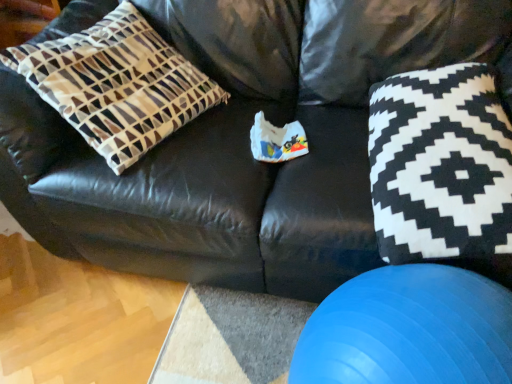
Describe the element at coordinates (409, 330) in the screenshot. I see `blue rubber ball at lower right` at that location.

Identify the location of black and white fabric pillow at right. This screenshot has width=512, height=384. (440, 165).

Is the position of blue rubber ball at lower right more distant than that of black and white fabric pillow at right?

No, blue rubber ball at lower right is closer to the camera.

From the image's perspective, is blue rubber ball at lower right over black and white fabric pillow at right?

Incorrect, from the image's perspective, blue rubber ball at lower right is lower than black and white fabric pillow at right.

Would you say blue rubber ball at lower right is inside or outside black and white fabric pillow at right?

blue rubber ball at lower right is not inside black and white fabric pillow at right, it's outside.

From a real-world perspective, which object rests below the other?

blue rubber ball at lower right is physically lower.

From a real-world perspective, between black and white fabric pillow at right and brown and white geometric pillow at left, who is vertically lower?

black and white fabric pillow at right, from a real-world perspective.

Between black and white fabric pillow at right and brown and white geometric pillow at left, which one has larger width?

black and white fabric pillow at right is wider.

Is black and white fabric pillow at right behind brown and white geometric pillow at left?

No, black and white fabric pillow at right is closer to the viewer.

Is black and white fabric pillow at right not near brown and white geometric pillow at left?

No.

Looking at the image, does black and white fabric pillow at right seem bigger or smaller compared to blue rubber ball at lower right?

black and white fabric pillow at right is smaller than blue rubber ball at lower right.

Who is taller, black and white fabric pillow at right or blue rubber ball at lower right?

Standing taller between the two is blue rubber ball at lower right.

Which is in front, point (387, 80) or point (410, 288)?

Positioned in front is point (410, 288).

Which object is positioned more to the right, black and white fabric pillow at right or blue rubber ball at lower right?

black and white fabric pillow at right.

At what (x,y) coordinates should I click in order to perform the action: click on throw pillow below the brown and white geometric pillow at left (from the image's perspective). Please return your answer as a coordinate pair (x, y). The height and width of the screenshot is (384, 512). Looking at the image, I should click on (440, 165).

Is brown and white geometric pillow at left aimed at black and white fabric pillow at right?

No, brown and white geometric pillow at left is not oriented towards black and white fabric pillow at right.

From the image's perspective, is brown and white geometric pillow at left above or below black and white fabric pillow at right?

Clearly, from the image's perspective, brown and white geometric pillow at left is above black and white fabric pillow at right.

From the image's perspective, relative to brown and white geometric pillow at left, is blue rubber ball at lower right above or below?

Based on their image positions, blue rubber ball at lower right is located beneath brown and white geometric pillow at left.

From a real-world perspective, is blue rubber ball at lower right above or below brown and white geometric pillow at left?

From a real-world perspective, blue rubber ball at lower right is physically below brown and white geometric pillow at left.

Is brown and white geometric pillow at left surrounded by blue rubber ball at lower right?

No, brown and white geometric pillow at left is not surrounded by blue rubber ball at lower right.

Is blue rubber ball at lower right beside brown and white geometric pillow at left?

No, blue rubber ball at lower right is not touching brown and white geometric pillow at left.

From the image's perspective, which one is positioned lower, brown and white geometric pillow at left or blue rubber ball at lower right?

blue rubber ball at lower right, from the image's perspective.

Would you consider brown and white geometric pillow at left to be distant from blue rubber ball at lower right?

No, brown and white geometric pillow at left is not far away from blue rubber ball at lower right.

Locate an element on the screen. ball located below the brown and white geometric pillow at left (from the image's perspective) is located at coordinates (409, 330).

From a real-world perspective, does brown and white geometric pillow at left stand above blue rubber ball at lower right?

Yes, from a real-world perspective, brown and white geometric pillow at left is on top of blue rubber ball at lower right.

You are a GUI agent. You are given a task and a screenshot of the screen. Output one action in this format:
    pyautogui.click(x=<x>, y=<y>)
    Task: Click on the ball on the left of black and white fabric pillow at right
    Image resolution: width=512 pixels, height=384 pixels.
    Given the screenshot: What is the action you would take?
    pyautogui.click(x=409, y=330)

Locate an element on the screen. Image resolution: width=512 pixels, height=384 pixels. throw pillow below the brown and white geometric pillow at left (from a real-world perspective) is located at coordinates [440, 165].

Considering their positions, is black and white fabric pillow at right positioned further to blue rubber ball at lower right than brown and white geometric pillow at left?

The object further to blue rubber ball at lower right is brown and white geometric pillow at left.

Looking at the image, which one is located further to black and white fabric pillow at right, blue rubber ball at lower right or brown and white geometric pillow at left?

Based on the image, brown and white geometric pillow at left appears to be further to black and white fabric pillow at right.

Considering their positions, is brown and white geometric pillow at left positioned further to black and white fabric pillow at right than blue rubber ball at lower right?

brown and white geometric pillow at left is further to black and white fabric pillow at right.

From the image, which object appears to be farther from blue rubber ball at lower right, brown and white geometric pillow at left or black and white fabric pillow at right?

The object further to blue rubber ball at lower right is brown and white geometric pillow at left.

Based on their spatial positions, is black and white fabric pillow at right or blue rubber ball at lower right further from brown and white geometric pillow at left?

blue rubber ball at lower right is further to brown and white geometric pillow at left.

Considering their positions, is blue rubber ball at lower right positioned closer to brown and white geometric pillow at left than black and white fabric pillow at right?

black and white fabric pillow at right.

Find the location of `ball between brown and white geometric pillow at left and black and white fabric pillow at right`. ball between brown and white geometric pillow at left and black and white fabric pillow at right is located at coordinates (409, 330).